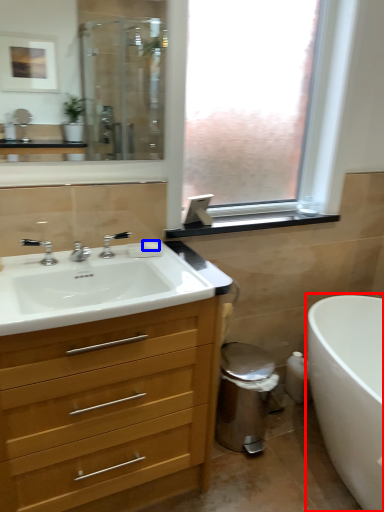
Question: Which object appears closest to the camera in this image, bath (highlighted by a red box) or soap (highlighted by a blue box)?

Choices:
 (A) bath
 (B) soap

Answer: (A)